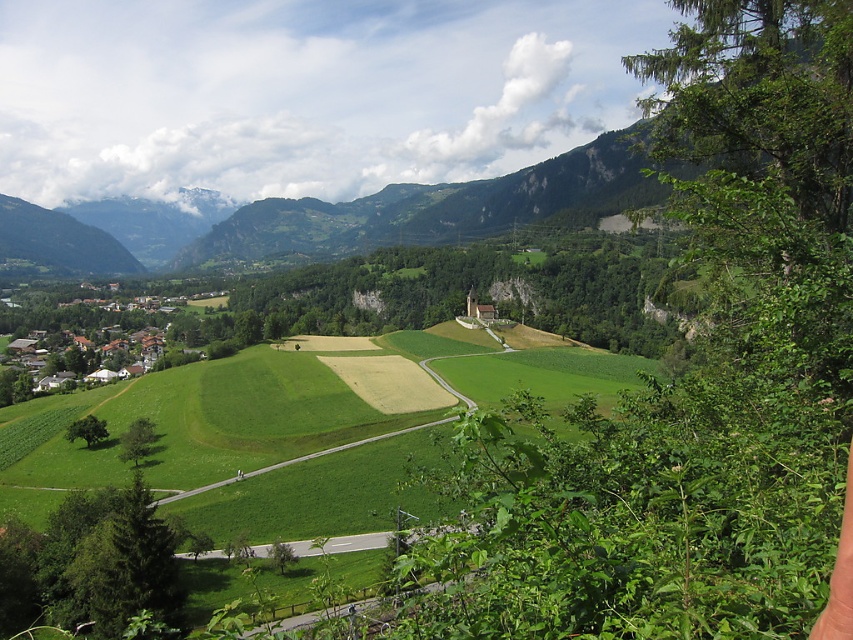
Which is in front, point (108, 388) or point (126, 336)?

Point (108, 388)

Is point (277, 422) closer to camera compared to point (77, 323)?

That is True.

Where is `green grass field at center`? The width and height of the screenshot is (853, 640). green grass field at center is located at coordinates (216, 420).